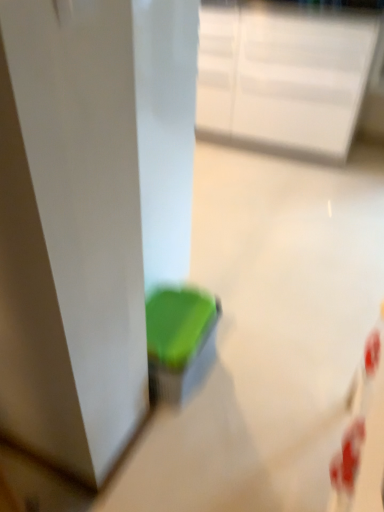
This screenshot has width=384, height=512. I want to click on vacant area that is in front of green plastic container at center, so click(187, 443).